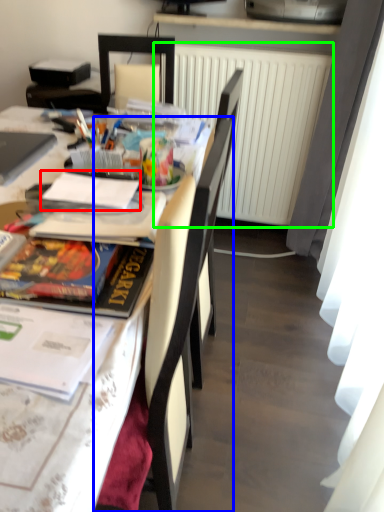
Question: Which object is the farthest from journal (highlighted by a red box)? Choose among these: chair (highlighted by a blue box) or radiator (highlighted by a green box).

Choices:
 (A) chair
 (B) radiator

Answer: (B)